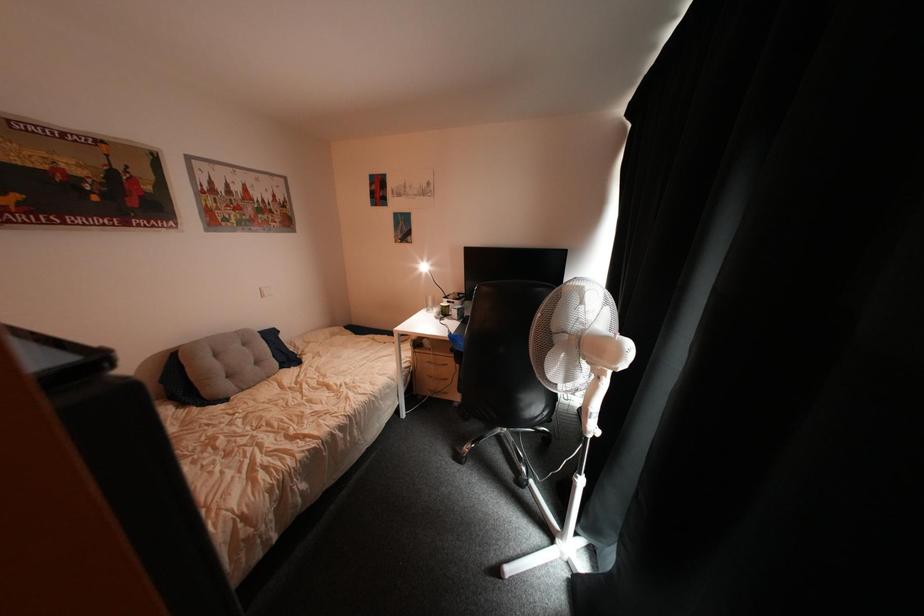
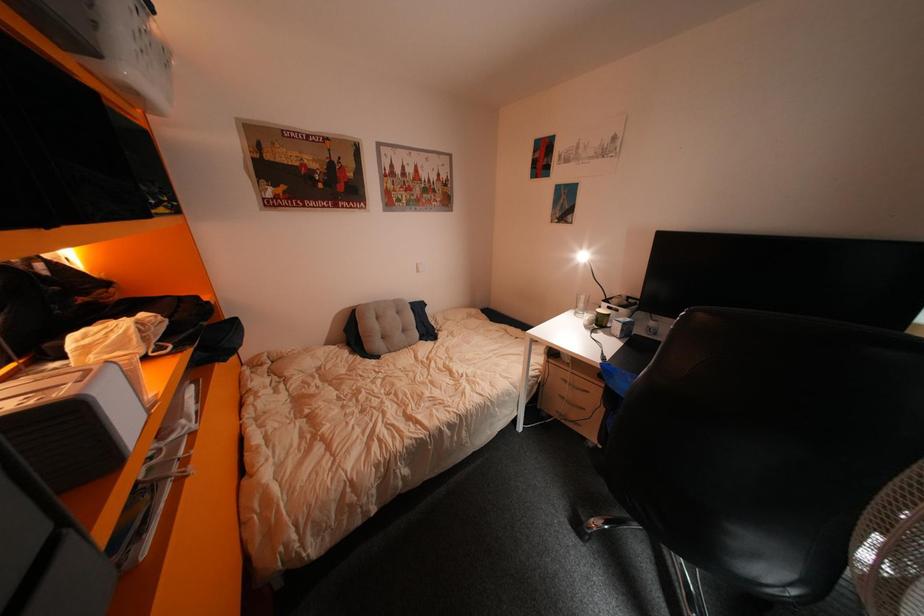
Question: The camera is either moving clockwise (left) or counter-clockwise (right) around the object. The first image is from the beginning of the video and the second image is from the end. Is the camera moving left or right when shooting the video?

Choices:
 (A) Left
 (B) Right

Answer: (B)